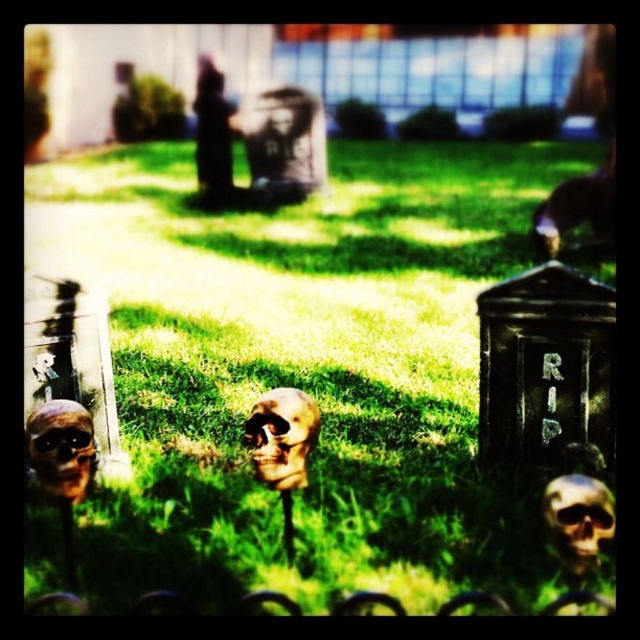
You are a visitor at a Halloween decoration store. You see two skulls displayed on the shelf, the brown matte skull at center and the gold metallic skull at lower center. Which one is taller?

The brown matte skull at center is taller than the gold metallic skull at lower center.

You are a decorator setting up for a Halloween event. You have two skulls to place on a shelf that can only hold items up to 1.2 meters in width. The brown matte skull at center and the gold metallic skull at lower center. Based on their sizes, which one should you choose to ensure it fits?

The brown matte skull at center might be wider than gold metallic skull at lower center, so to ensure it fits on the shelf, the gold metallic skull at lower center should be chosen since it is likely narrower.

You are a gardener trying to place a new decorative pumpkin between the green grass at center and the gold metallic skull at lower center. Which area has more space available for the pumpkin?

The green grass at center is wider than the gold metallic skull at lower center, so the green grass at center has more space available for the pumpkin.